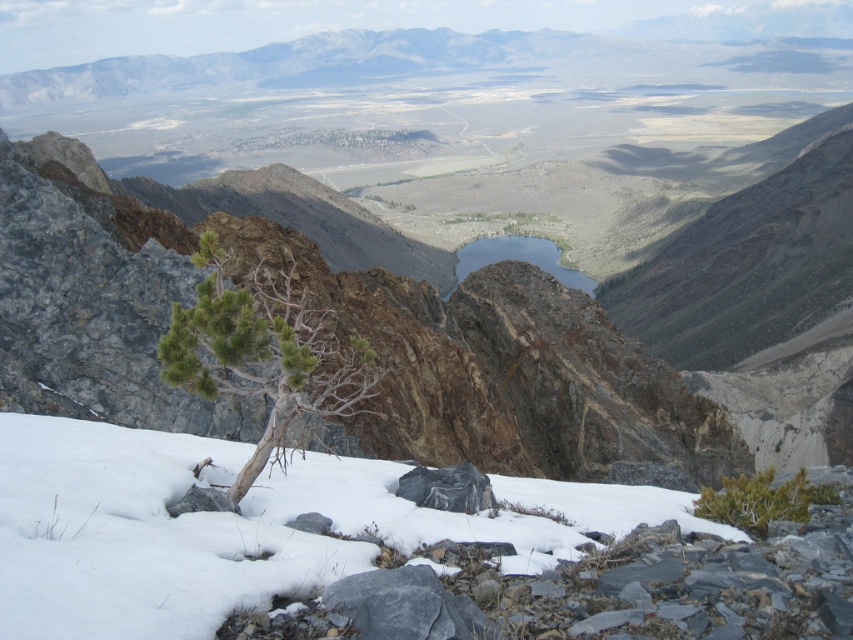
Question: Which point is farther to the camera?

Choices:
 (A) gray/granite rock at center
 (B) green needle-like tree at center-left
 (C) gray rock at lower center
 (D) white powdery snow at lower left

Answer: (A)

Question: Is green needle-like tree at center-left further to the viewer compared to gray rock at lower center?

Choices:
 (A) yes
 (B) no

Answer: (A)

Question: Is green textured shrub at lower right to the left of clear glass lake at center from the viewer's perspective?

Choices:
 (A) no
 (B) yes

Answer: (A)

Question: Based on their relative distances, which object is nearer to the gray rock at lower center?

Choices:
 (A) clear glass lake at center
 (B) green textured shrub at lower right

Answer: (B)

Question: Among these points, which one is farthest from the camera?

Choices:
 (A) (213, 240)
 (B) (560, 276)
 (C) (807, 518)

Answer: (B)

Question: Can you confirm if green textured shrub at lower right is positioned to the left of gray rock at lower center?

Choices:
 (A) yes
 (B) no

Answer: (B)